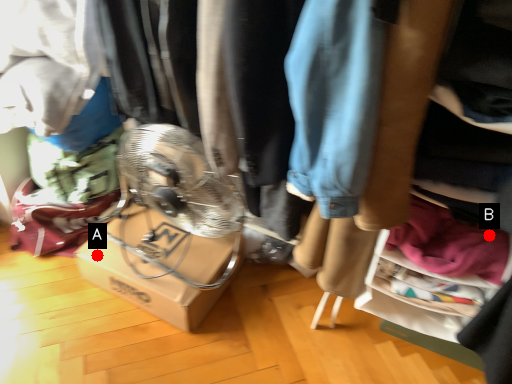
Question: Two points are circled on the image, labeled by A and B beside each circle. Which point is closer to the camera?

Choices:
 (A) A is closer
 (B) B is closer

Answer: (B)